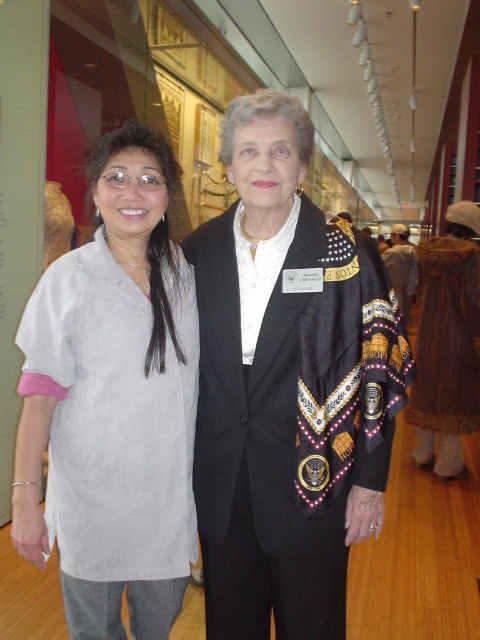
This screenshot has height=640, width=480. In order to click on black satin jacket at center in this screenshot , I will do `click(288, 387)`.

Does black satin jacket at center appear under light gray fabric shirt at left?

Incorrect, black satin jacket at center is not positioned below light gray fabric shirt at left.

The image size is (480, 640). Find the location of `black satin jacket at center`. black satin jacket at center is located at coordinates (288, 387).